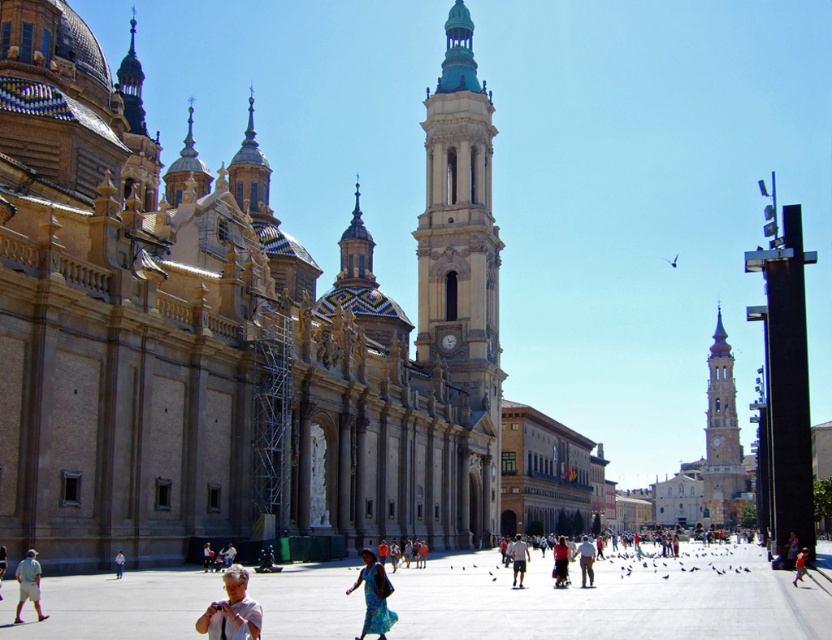
You are an architect visiting the plaza and need to place a small model of the cathedral on the ground. The model is the size of the matte white shirt at lower center. Will the smooth concrete plaza at center have enough space to accommodate the model?

The smooth concrete plaza at center is bigger than the matte white shirt at lower center, so yes, the plaza has sufficient space to accommodate the model.

You are standing in the plaza facing the cathedral. There are two points marked in the image. The first point is at coordinates point (382, 624) and the second is at point (122, 570). Which point is closer to you?

Point (382, 624) is closer to the camera than point (122, 570).